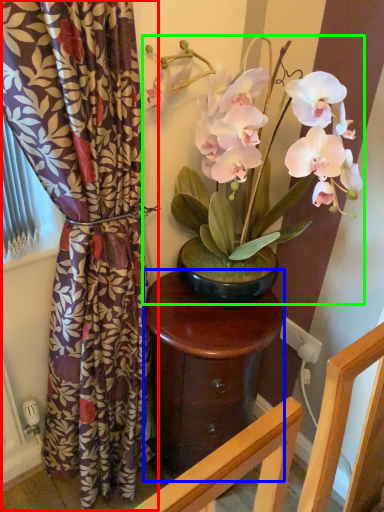
Question: Based on their relative distances, which object is nearer to curtain (highlighted by a red box)? Choose from table (highlighted by a blue box) and houseplant (highlighted by a green box).

Choices:
 (A) table
 (B) houseplant

Answer: (A)